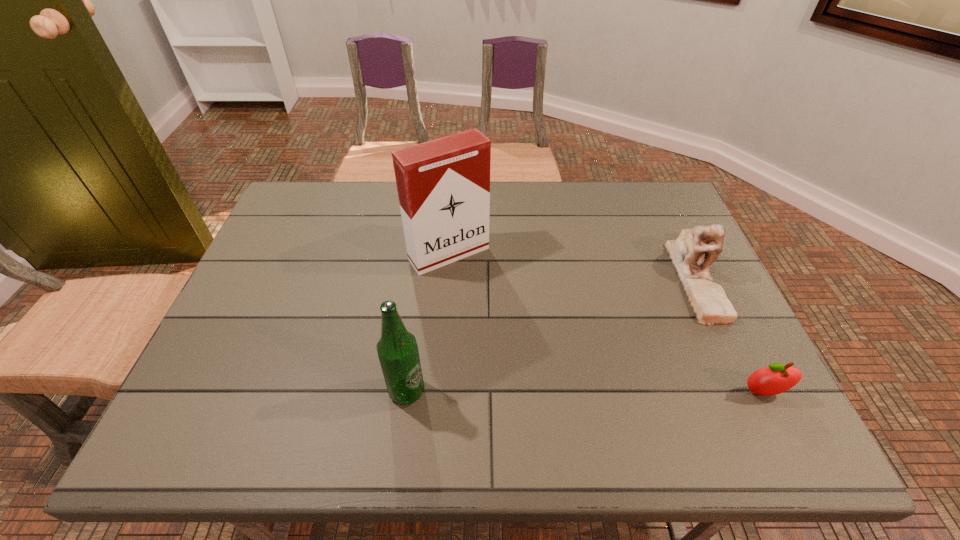
You are a GUI agent. You are given a task and a screenshot of the screen. Output one action in this format:
    pyautogui.click(x=<x>, y=<y>)
    Task: Click on the vacant space located on the front-facing side of the cigarette_case
    This screenshot has width=960, height=540.
    Given the screenshot: What is the action you would take?
    pyautogui.click(x=490, y=299)

Where is `beer bottle at the near edge`? beer bottle at the near edge is located at coordinates (397, 349).

The height and width of the screenshot is (540, 960). I want to click on apple present at the near edge, so click(777, 378).

The width and height of the screenshot is (960, 540). What are the coordinates of `apple present at the right edge` in the screenshot? It's located at (777, 378).

Where is `figurine present at the right edge`? This screenshot has height=540, width=960. figurine present at the right edge is located at coordinates (709, 302).

The height and width of the screenshot is (540, 960). Find the location of `object located in the near right corner section of the desktop`. object located in the near right corner section of the desktop is located at coordinates (777, 378).

Find the location of a particular element. This screenshot has width=960, height=540. free space at the far edge of the desktop is located at coordinates [x=507, y=222].

This screenshot has height=540, width=960. Find the location of `vacant region at the near edge of the desktop`. vacant region at the near edge of the desktop is located at coordinates 549,374.

At what (x,y) coordinates should I click in order to perform the action: click on vacant region at the left edge of the desktop. Please return your answer as a coordinate pair (x, y). The height and width of the screenshot is (540, 960). Looking at the image, I should click on (285, 332).

This screenshot has height=540, width=960. I want to click on free space at the right edge, so click(754, 357).